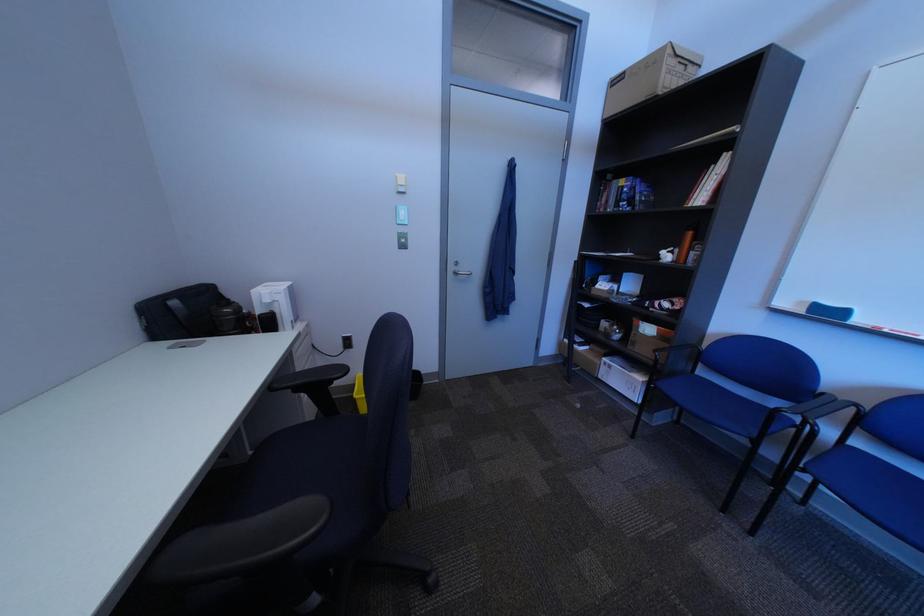
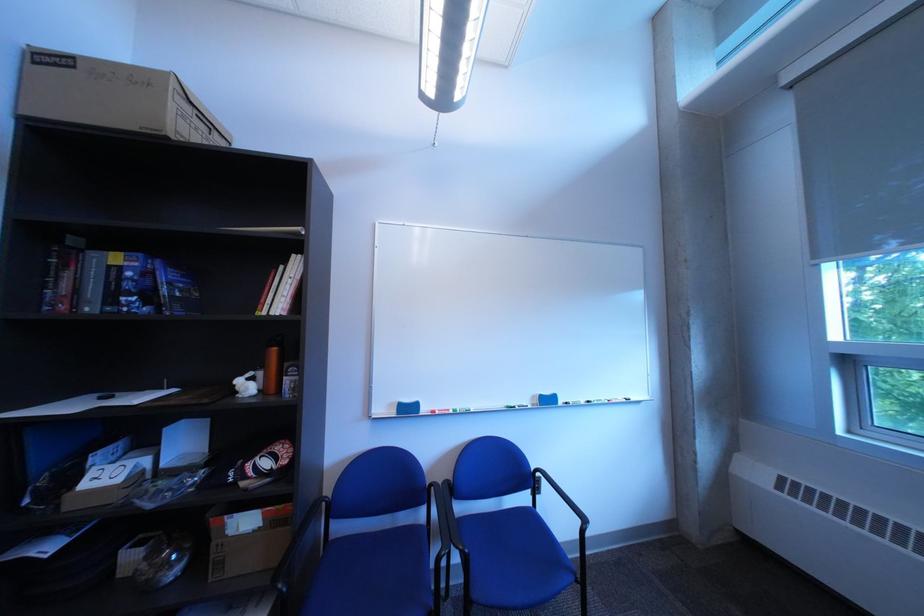
In the second image, find the point that corresponds to point 833,430 in the first image.

(482, 553)